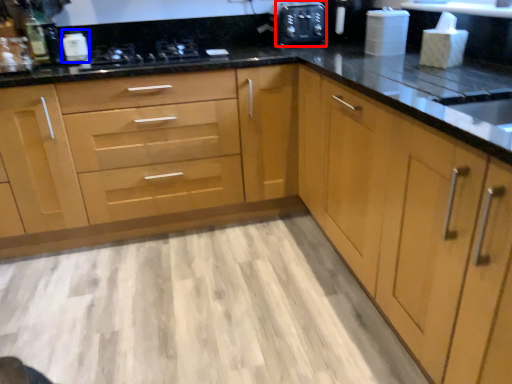
Question: Which object appears farthest to the camera in this image, appliance (highlighted by a red box) or appliance (highlighted by a blue box)?

Choices:
 (A) appliance
 (B) appliance

Answer: (A)